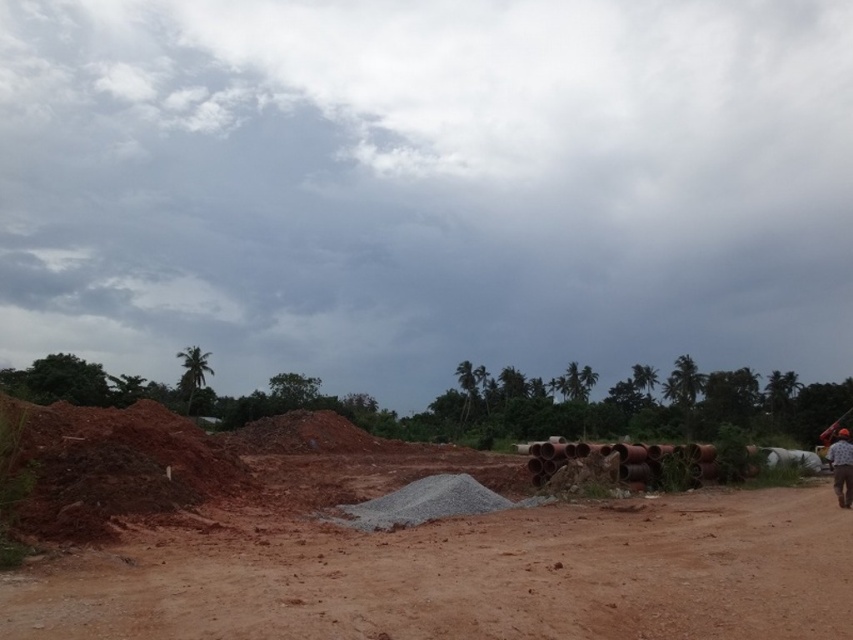
Who is taller, brown dirt field at center or brown fabric shirt at lower right?

With more height is brown fabric shirt at lower right.

What do you see at coordinates (467, 577) in the screenshot? The height and width of the screenshot is (640, 853). I see `brown dirt field at center` at bounding box center [467, 577].

Which is in front, point (625, 544) or point (845, 429)?

Positioned in front is point (625, 544).

The image size is (853, 640). Find the location of `brown dirt field at center`. brown dirt field at center is located at coordinates (467, 577).